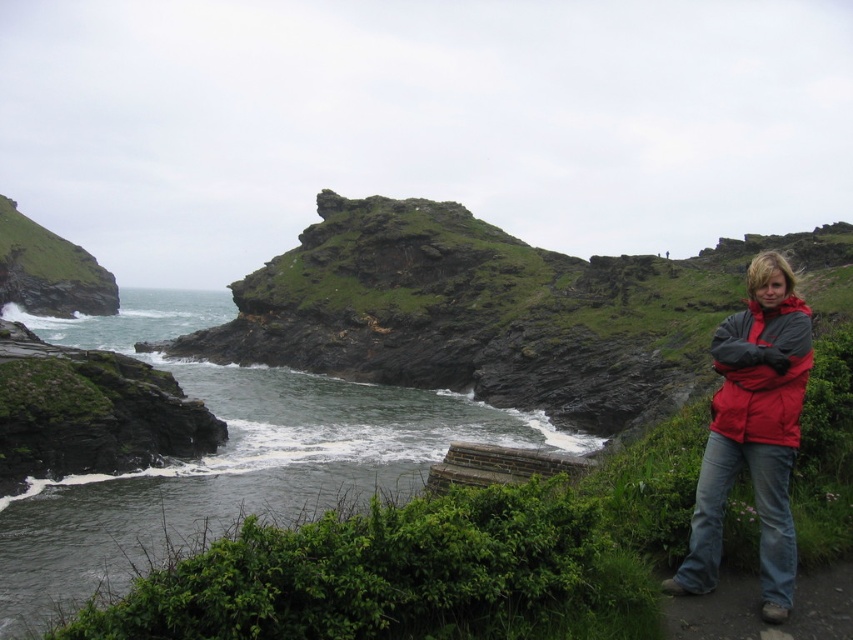
Question: Which object is closer to the camera taking this photo?

Choices:
 (A) brown dirt path at lower right
 (B) matte red jacket at right

Answer: (A)

Question: From the image, what is the correct spatial relationship of brown dirt path at lower right in relation to green grassy hillside at left?

Choices:
 (A) above
 (B) below

Answer: (B)

Question: Does red fleece jacket at right appear over green grassy hillside at left?

Choices:
 (A) no
 (B) yes

Answer: (A)

Question: Which point is closer to the camera?

Choices:
 (A) [x=125, y=292]
 (B) [x=68, y=248]
 (C) [x=689, y=536]
 (D) [x=726, y=618]

Answer: (D)

Question: Estimate the real-world distances between objects in this image. Which object is farther from the green grassy hillside at left?

Choices:
 (A) red fleece jacket at right
 (B) brown dirt path at lower right

Answer: (A)

Question: Does greenish-gray water at center-left have a smaller size compared to matte red jacket at right?

Choices:
 (A) yes
 (B) no

Answer: (B)